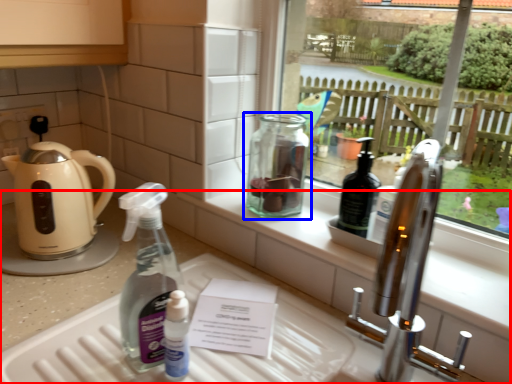
Question: Which object is closer to the camera taking this photo, counter (highlighted by a red box) or bottle (highlighted by a blue box)?

Choices:
 (A) counter
 (B) bottle

Answer: (A)